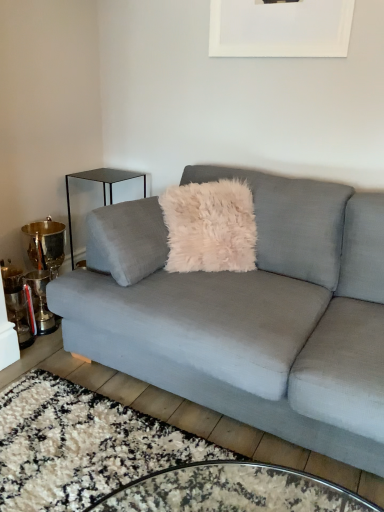
Question: Does velvet gray couch at center have a greater height compared to black glass side table at left?

Choices:
 (A) yes
 (B) no

Answer: (A)

Question: Considering the relative sizes of velvet gray couch at center and black glass side table at left in the image provided, is velvet gray couch at center shorter than black glass side table at left?

Choices:
 (A) no
 (B) yes

Answer: (A)

Question: Considering the relative sizes of velvet gray couch at center and black glass side table at left in the image provided, is velvet gray couch at center bigger than black glass side table at left?

Choices:
 (A) no
 (B) yes

Answer: (B)

Question: Would you say velvet gray couch at center is a long distance from black glass side table at left?

Choices:
 (A) no
 (B) yes

Answer: (B)

Question: Is the position of velvet gray couch at center more distant than that of black glass side table at left?

Choices:
 (A) no
 (B) yes

Answer: (A)

Question: Considering the positions of black glass side table at left and velvet gray couch at center in the image, is black glass side table at left wider or thinner than velvet gray couch at center?

Choices:
 (A) wide
 (B) thin

Answer: (B)

Question: From the image's perspective, is black glass side table at left located above or below velvet gray couch at center?

Choices:
 (A) below
 (B) above

Answer: (B)

Question: From a real-world perspective, relative to velvet gray couch at center, is black glass side table at left vertically above or below?

Choices:
 (A) below
 (B) above

Answer: (A)

Question: Is black glass side table at left taller or shorter than velvet gray couch at center?

Choices:
 (A) short
 (B) tall

Answer: (A)

Question: Is white matte picture frame at upper center taller or shorter than black glass side table at left?

Choices:
 (A) tall
 (B) short

Answer: (B)

Question: From the image's perspective, relative to black glass side table at left, is white matte picture frame at upper center above or below?

Choices:
 (A) above
 (B) below

Answer: (A)

Question: Considering their positions, is white matte picture frame at upper center located in front of or behind black glass side table at left?

Choices:
 (A) behind
 (B) front

Answer: (B)

Question: Based on their sizes in the image, would you say white matte picture frame at upper center is bigger or smaller than black glass side table at left?

Choices:
 (A) big
 (B) small

Answer: (B)

Question: Based on their positions, is velvet gray couch at center located to the left or right of black glass side table at left?

Choices:
 (A) left
 (B) right

Answer: (B)

Question: Is velvet gray couch at center in front of or behind black glass side table at left in the image?

Choices:
 (A) front
 (B) behind

Answer: (A)